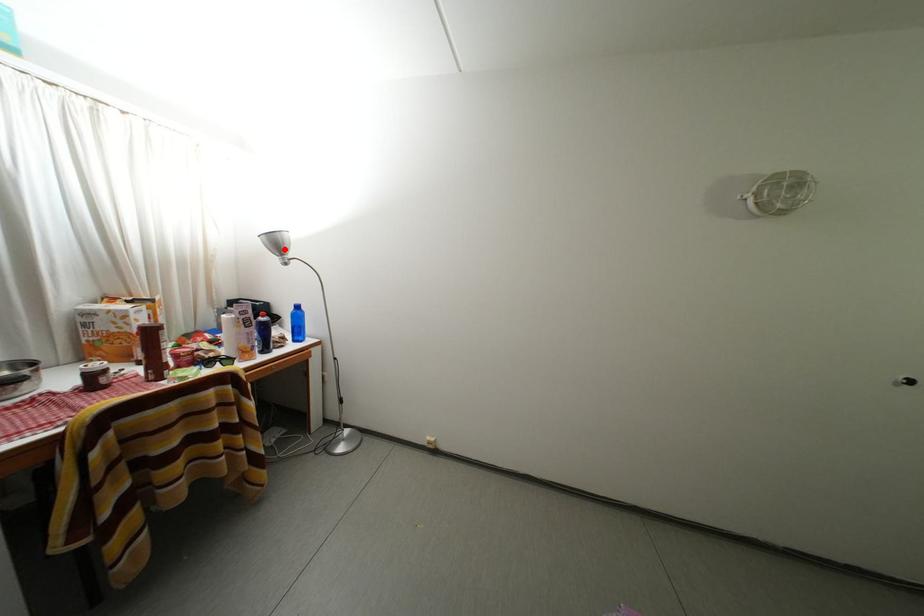
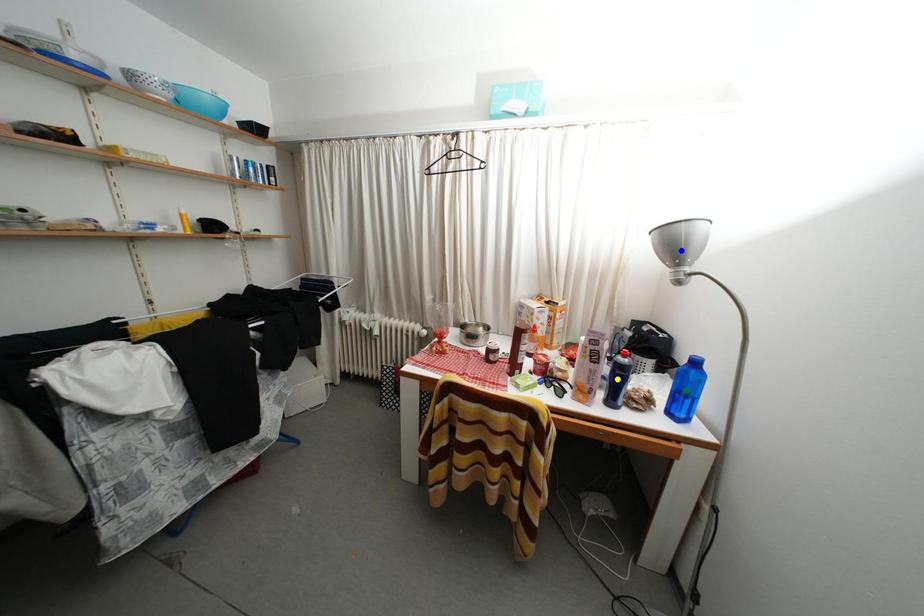
Question: I am providing you with two images of the same scene from different viewpoints. A red point is marked on the first image. You are given multiple points on the second image. Which mark in image 2 goes with the point in image 1?

Choices:
 (A) green point
 (B) yellow point
 (C) blue point

Answer: (C)